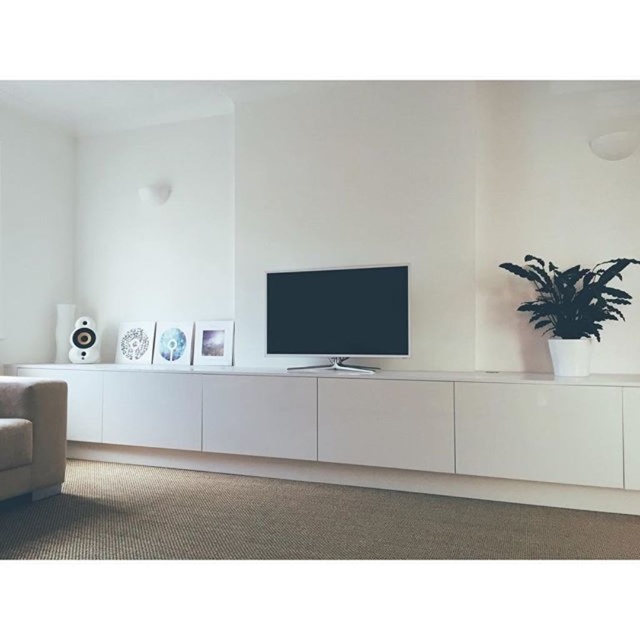
Can you confirm if flat screen tv at center is smaller than green leafy plant at right?

Actually, flat screen tv at center might be larger than green leafy plant at right.

Is flat screen tv at center to the left of green leafy plant at right from the viewer's perspective?

Indeed, flat screen tv at center is positioned on the left side of green leafy plant at right.

Where is `flat screen tv at center`? This screenshot has height=640, width=640. flat screen tv at center is located at coordinates (337, 314).

Can you confirm if white glossy entertainment center at center is shorter than flat screen tv at center?

No, white glossy entertainment center at center is not shorter than flat screen tv at center.

At what (x,y) coordinates should I click in order to perform the action: click on white glossy entertainment center at center. Please return your answer as a coordinate pair (x, y). The image size is (640, 640). Looking at the image, I should click on (369, 429).

The width and height of the screenshot is (640, 640). I want to click on white glossy entertainment center at center, so click(369, 429).

Is flat screen tv at center positioned in front of white glossy speaker at left?

Yes, it is in front of white glossy speaker at left.

Does flat screen tv at center appear on the left side of white glossy speaker at left?

Incorrect, flat screen tv at center is not on the left side of white glossy speaker at left.

Who is more forward, (358, 342) or (93, 337)?

Point (358, 342) is in front.

At what (x,y) coordinates should I click in order to perform the action: click on flat screen tv at center. Please return your answer as a coordinate pair (x, y). The height and width of the screenshot is (640, 640). Looking at the image, I should click on (337, 314).